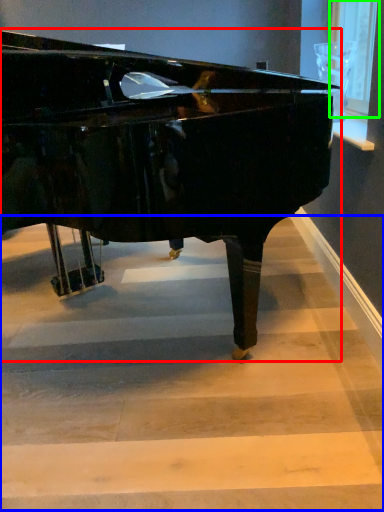
Question: Based on their relative distances, which object is farther from piano (highlighted by a red box)? Choose from stairwell (highlighted by a blue box) and window screen (highlighted by a green box).

Choices:
 (A) stairwell
 (B) window screen

Answer: (B)